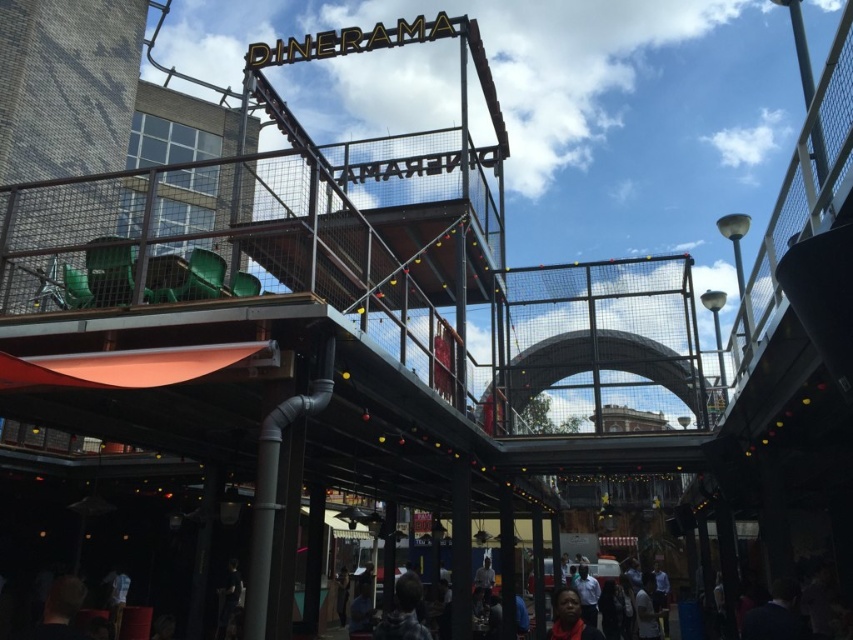
Question: From the image, what is the correct spatial relationship of smooth skin face at lower center in relation to white shirt at lower center?

Choices:
 (A) left
 (B) right

Answer: (A)

Question: Can you confirm if dark gray hoodie at lower center is positioned above smooth skin face at lower center?

Choices:
 (A) yes
 (B) no

Answer: (B)

Question: Which object is farther from the camera taking this photo?

Choices:
 (A) dark gray hoodie at lower center
 (B) white shirt at lower center
 (C) smooth skin face at lower center

Answer: (B)

Question: Does dark gray hoodie at lower center appear over white shirt at lower center?

Choices:
 (A) no
 (B) yes

Answer: (B)

Question: Which point appears closest to the camera in this image?

Choices:
 (A) (407, 616)
 (B) (577, 608)
 (C) (596, 609)

Answer: (A)

Question: Which object is the farthest from the white shirt at lower center?

Choices:
 (A) dark gray hoodie at lower center
 (B) smooth skin face at lower center

Answer: (A)